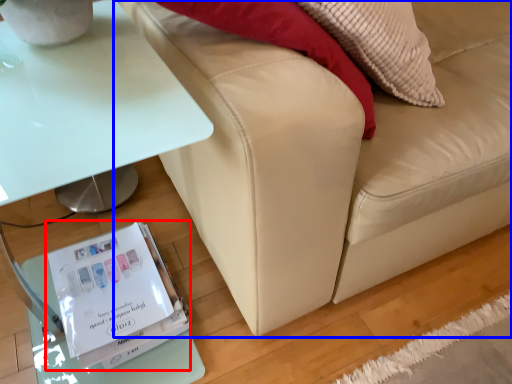
Question: Which object is further to the camera taking this photo, paperback book (highlighted by a red box) or studio couch (highlighted by a blue box)?

Choices:
 (A) paperback book
 (B) studio couch

Answer: (A)